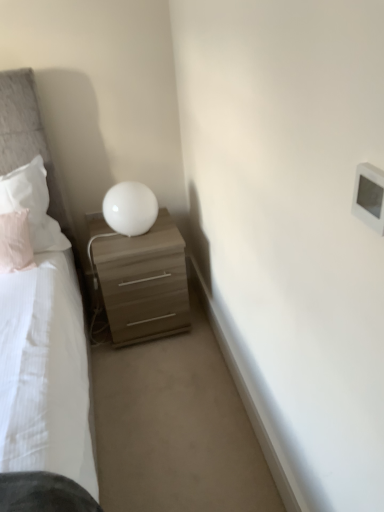
Question: From a real-world perspective, is white glossy sphere at upper right positioned above or below light brown wood nightstand at center?

Choices:
 (A) above
 (B) below

Answer: (A)

Question: In terms of height, does white glossy sphere at upper right look taller or shorter compared to light brown wood nightstand at center?

Choices:
 (A) tall
 (B) short

Answer: (B)

Question: Which object is the farthest from the pink fabric pillow at left, which ranks as the second pillow in top-to-bottom order?

Choices:
 (A) light brown wood nightstand at center
 (B) white plastic light switch at upper right
 (C) white soft pillow at left, which appears as the second pillow when ordered from the bottom
 (D) white glossy sphere at upper right

Answer: (B)

Question: Which of these objects is positioned closest to the light brown wood nightstand at center?

Choices:
 (A) white glossy sphere at upper right
 (B) pink fabric pillow at left, which ranks as the second pillow in top-to-bottom order
 (C) white soft pillow at left, acting as the 1th pillow starting from the top
 (D) white plastic light switch at upper right

Answer: (A)